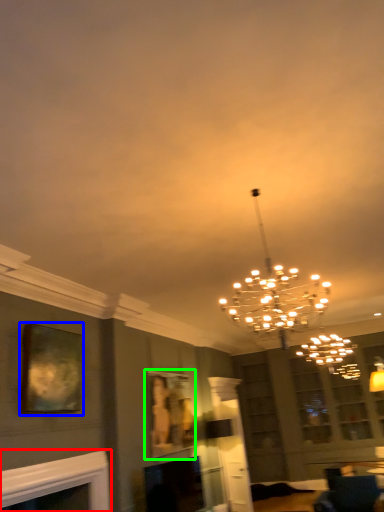
Question: Considering the real-world distances, which object is closest to fireplace (highlighted by a red box)? picture frame (highlighted by a blue box) or picture frame (highlighted by a green box).

Choices:
 (A) picture frame
 (B) picture frame

Answer: (A)